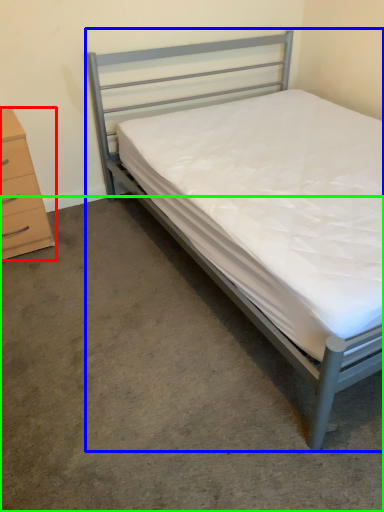
Question: Which object is positioned closest to chest of drawers (highlighted by a red box)? Select from bed (highlighted by a blue box) and concrete (highlighted by a green box).

Choices:
 (A) bed
 (B) concrete

Answer: (A)